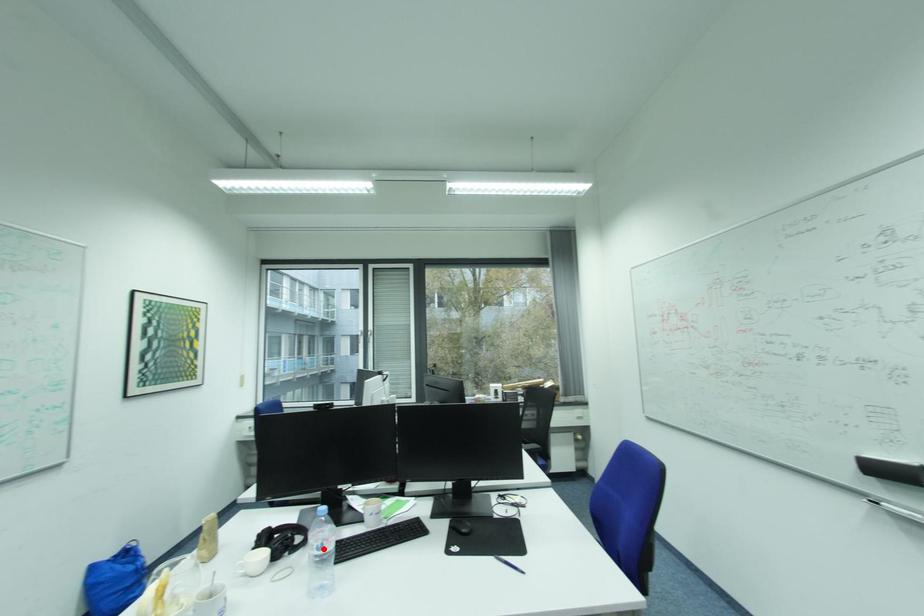
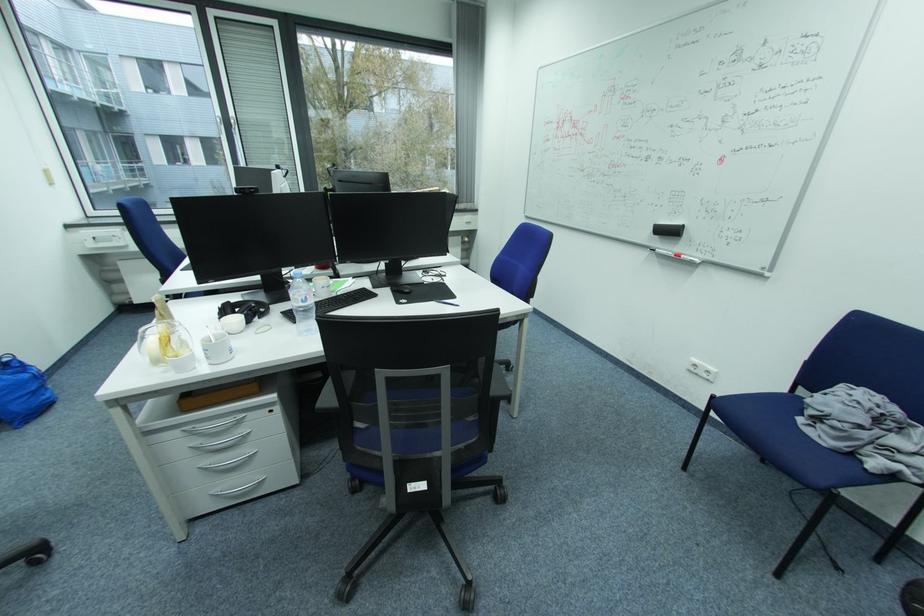
Question: I am providing you with two images of the same scene from different viewpoints. A red point is shown in image1. For the corresponding object point in image2, is it positioned nearer or farther from the camera?

Choices:
 (A) Nearer
 (B) Farther

Answer: (A)